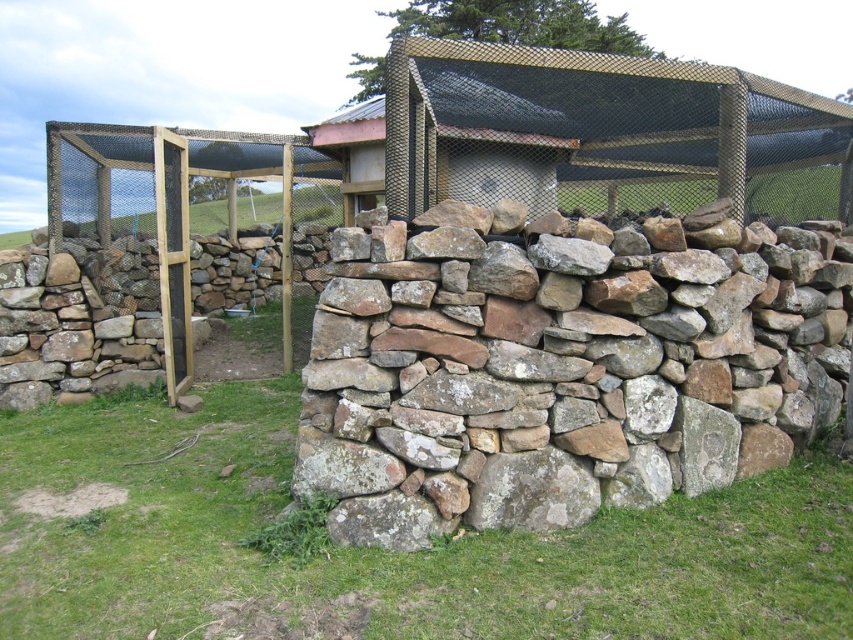
Question: Is natural stone wall at center further to the viewer compared to metallic mesh hut at center?

Choices:
 (A) yes
 (B) no

Answer: (B)

Question: Which point is closer to the camera?

Choices:
 (A) metallic mesh hut at center
 (B) green grass at lower center
 (C) wooden mesh cage at center

Answer: (B)

Question: Is wooden mesh cage at center wider than metallic mesh hut at center?

Choices:
 (A) yes
 (B) no

Answer: (B)

Question: Among these points, which one is nearest to the camera?

Choices:
 (A) (577, 134)
 (B) (323, 408)

Answer: (B)

Question: Which object is positioned farthest from the wooden mesh cage at center?

Choices:
 (A) green grass at lower center
 (B) natural stone wall at center

Answer: (B)

Question: Is natural stone wall at center thinner than green grass at lower center?

Choices:
 (A) yes
 (B) no

Answer: (A)